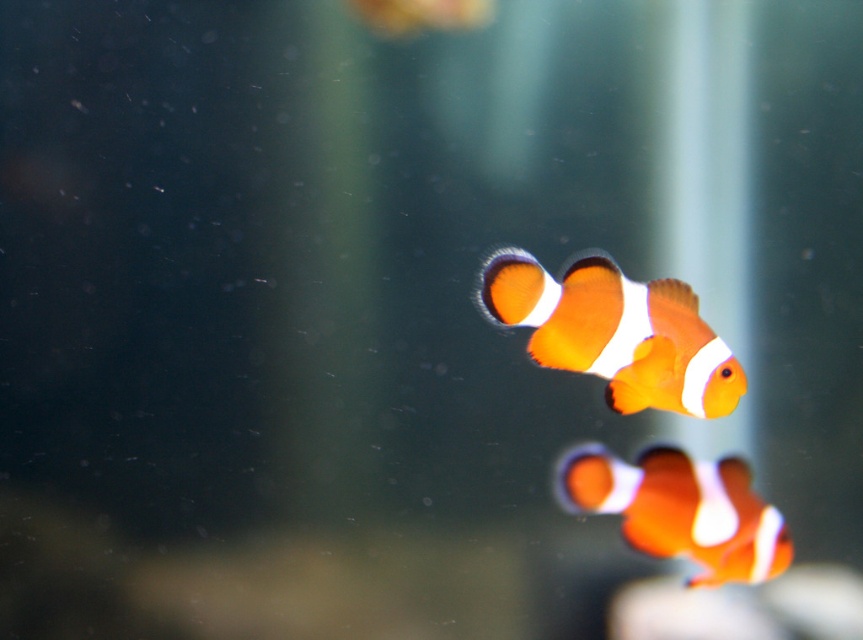
Is orange matte clownfish at center smaller than orange matte clownfish at lower right?

Yes, orange matte clownfish at center is smaller than orange matte clownfish at lower right.

Does orange matte clownfish at center appear over orange matte clownfish at lower right?

Indeed, orange matte clownfish at center is positioned over orange matte clownfish at lower right.

In the scene shown: Who is more forward, (620, 340) or (729, 492)?

Point (620, 340) is in front.

Where is `orange matte clownfish at center`? This screenshot has height=640, width=863. orange matte clownfish at center is located at coordinates (615, 332).